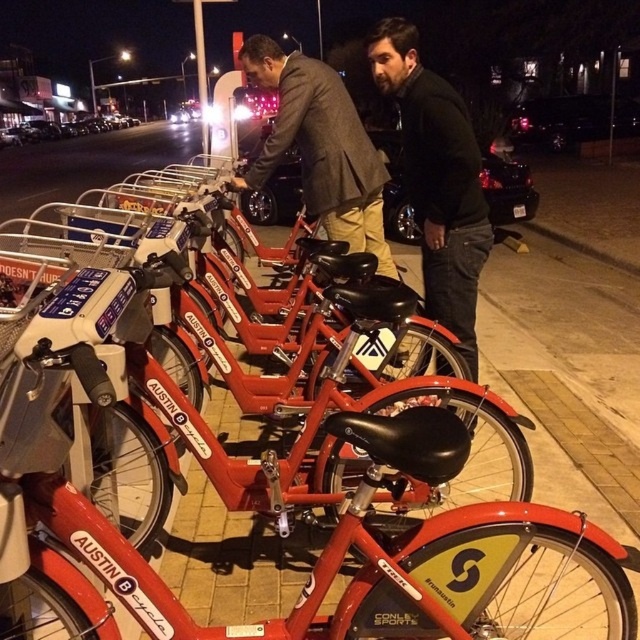
Who is higher up, matte red bicycle at center or matte black jacket at center?

matte black jacket at center is above.

Which is in front, point (131, 304) or point (477, 273)?

Positioned in front is point (131, 304).

The width and height of the screenshot is (640, 640). I want to click on matte red bicycle at center, so tap(282, 499).

You are a GUI agent. You are given a task and a screenshot of the screen. Output one action in this format:
    pyautogui.click(x=<x>, y=<y>)
    Task: Click on the matte red bicycle at center
    
    Given the screenshot: What is the action you would take?
    pyautogui.click(x=282, y=499)

Is point (476, 568) behind point (307, 77)?

No, it is not.

At what (x,y) coordinates should I click in order to perform the action: click on matte red bicycle at center. Please return your answer as a coordinate pair (x, y). Looking at the image, I should click on (282, 499).

Is point (125, 600) positioned after point (324, 141)?

No, (125, 600) is in front of (324, 141).

Locate an element on the screen. matte red bicycle at center is located at coordinates (282, 499).

Is point (438, 214) behind point (305, 115)?

No, (438, 214) is closer to viewer.

Can you confirm if dark brown leather jacket at center is positioned to the right of matte gray suit at center?

Indeed, dark brown leather jacket at center is positioned on the right side of matte gray suit at center.

The image size is (640, 640). In order to click on dark brown leather jacket at center in this screenshot , I will do `click(436, 179)`.